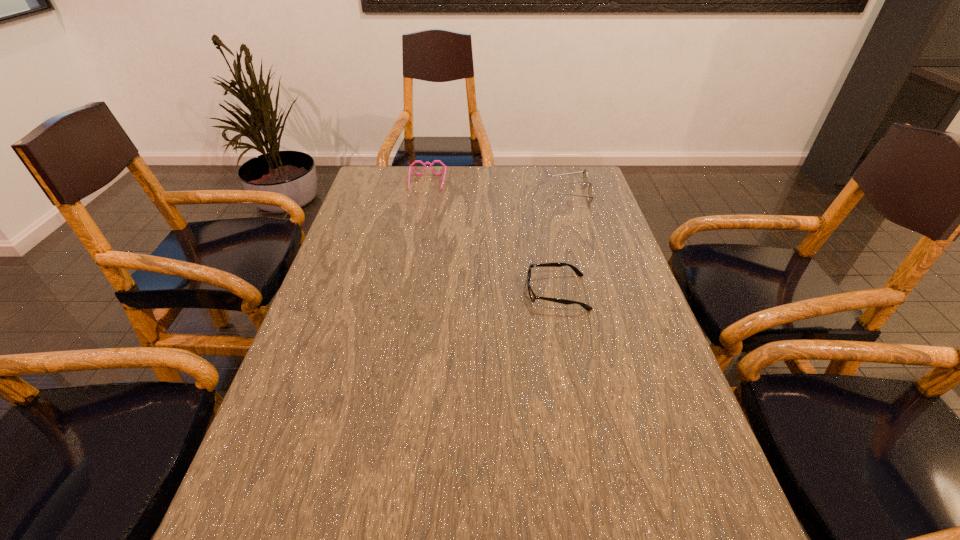
Image resolution: width=960 pixels, height=540 pixels. I want to click on blank space located 0.320m on the front-facing side of the shortest object, so click(x=396, y=293).

Identify the location of vacant area located 0.050m on the front-facing side of the shortest object. (506, 293).

At what (x,y) coordinates should I click in order to perform the action: click on object that is at the left edge. Please return your answer as a coordinate pair (x, y). Image resolution: width=960 pixels, height=540 pixels. Looking at the image, I should click on (410, 167).

Identify the location of object present at the far left corner. The height and width of the screenshot is (540, 960). (410, 167).

This screenshot has width=960, height=540. What are the coordinates of `object at the far right corner` in the screenshot? It's located at 590,196.

In order to click on vacant region at the far edge of the desktop in this screenshot , I will do `click(499, 180)`.

You are a GUI agent. You are given a task and a screenshot of the screen. Output one action in this format:
    pyautogui.click(x=<x>, y=<y>)
    Task: Click on the vacant space at the left edge of the desktop
    The height and width of the screenshot is (540, 960).
    Given the screenshot: What is the action you would take?
    pyautogui.click(x=309, y=365)

Locate an element on the screen. vacant space at the right edge of the desktop is located at coordinates coord(619,248).

Find the location of a particular element. The width and height of the screenshot is (960, 540). blank area at the far left corner is located at coordinates (405, 199).

The width and height of the screenshot is (960, 540). What are the coordinates of `empty space that is in between the second shortest object and the shortest object` in the screenshot? It's located at (492, 238).